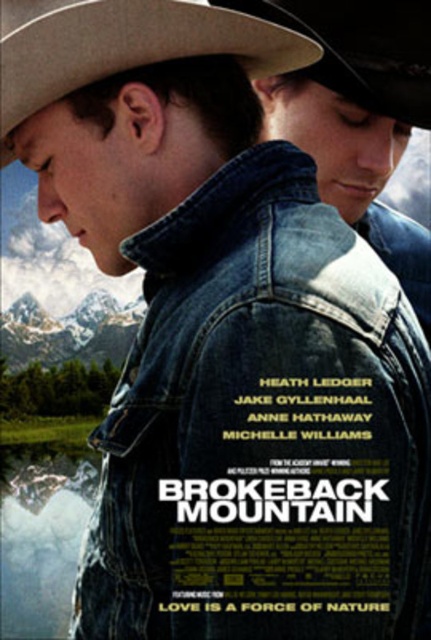
Question: Which object is closer to the camera taking this photo?

Choices:
 (A) rustic leather cowboy hat at upper center
 (B) denim jacket at center

Answer: (B)

Question: Based on their relative distances, which object is farther from the rustic leather cowboy hat at upper center?

Choices:
 (A) denim jacket at center
 (B) beige felt cowboy hat at upper left

Answer: (A)

Question: Can you confirm if beige felt cowboy hat at upper left is thinner than rustic leather cowboy hat at upper center?

Choices:
 (A) no
 (B) yes

Answer: (A)

Question: Which object is positioned farthest from the beige felt cowboy hat at upper left?

Choices:
 (A) rustic leather cowboy hat at upper center
 (B) denim jacket at center

Answer: (B)

Question: Can you confirm if beige felt cowboy hat at upper left is thinner than rustic leather cowboy hat at upper center?

Choices:
 (A) no
 (B) yes

Answer: (A)

Question: Is denim jacket at center further to camera compared to rustic leather cowboy hat at upper center?

Choices:
 (A) no
 (B) yes

Answer: (A)